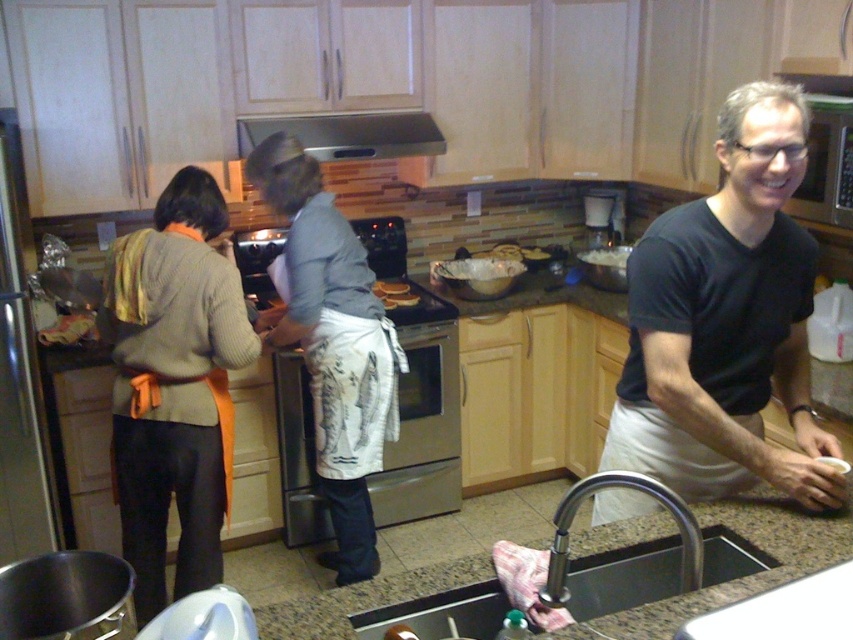
Question: Which object is positioned closest to the orange apron at left?

Choices:
 (A) white apron at center
 (B) metallic stainless steel sink at lower center

Answer: (A)

Question: Does metallic stainless steel sink at lower center have a larger size compared to brushed metal faucet at sink bottom?

Choices:
 (A) yes
 (B) no

Answer: (A)

Question: From the image, what is the correct spatial relationship of orange apron at left in relation to brushed metal faucet at sink bottom?

Choices:
 (A) left
 (B) right

Answer: (A)

Question: Which point is farther to the camera?

Choices:
 (A) white apron at center
 (B) orange apron at left
 (C) metallic stainless steel sink at lower center

Answer: (A)

Question: Which object is closer to the camera taking this photo?

Choices:
 (A) black matte shirt at right
 (B) metallic stainless steel sink at lower center

Answer: (B)

Question: Is white apron at center below metallic stainless steel sink at lower center?

Choices:
 (A) no
 (B) yes

Answer: (A)